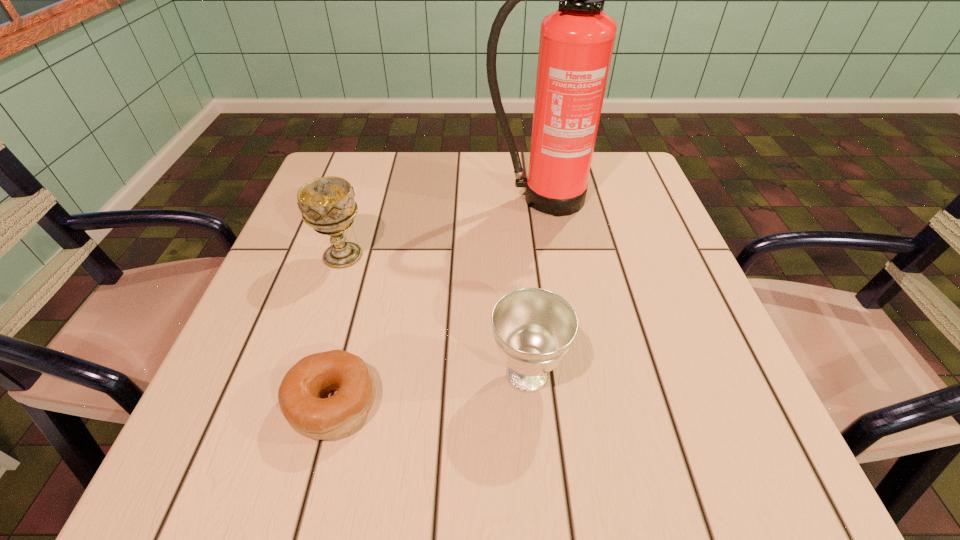
Where is `object at the far edge`? The height and width of the screenshot is (540, 960). object at the far edge is located at coordinates (576, 44).

What are the coordinates of `object situated at the near edge` in the screenshot? It's located at (300, 394).

Identify the location of chalice that is at the left edge. Image resolution: width=960 pixels, height=540 pixels. (327, 204).

Find the location of `bagel that is at the left edge`. bagel that is at the left edge is located at coordinates (300, 394).

Where is `object that is at the right edge`? The image size is (960, 540). object that is at the right edge is located at coordinates (576, 44).

Where is `object that is at the near left corner`? This screenshot has height=540, width=960. object that is at the near left corner is located at coordinates (300, 394).

Locate an element on the screen. The width and height of the screenshot is (960, 540). object that is at the far right corner is located at coordinates (576, 44).

This screenshot has width=960, height=540. I want to click on vacant position at the far edge of the desktop, so click(409, 179).

Image resolution: width=960 pixels, height=540 pixels. I want to click on vacant space at the near edge of the desktop, so [410, 442].

Locate an element on the screen. The height and width of the screenshot is (540, 960). free space at the left edge is located at coordinates (318, 253).